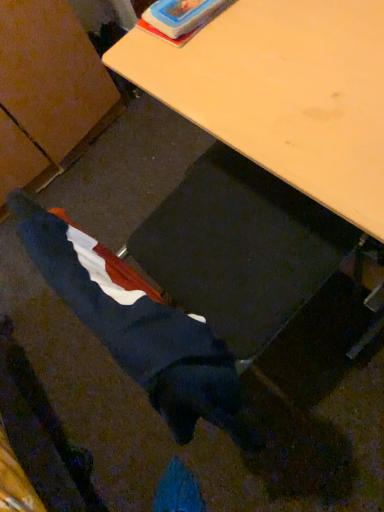
Question: Does velvet blue coat at lower left appear on the left side of wooden desk at center?

Choices:
 (A) no
 (B) yes

Answer: (B)

Question: Does velvet blue coat at lower left have a greater width compared to wooden desk at center?

Choices:
 (A) yes
 (B) no

Answer: (B)

Question: From the image's perspective, is velvet blue coat at lower left located beneath wooden desk at center?

Choices:
 (A) no
 (B) yes

Answer: (B)

Question: From the image's perspective, is velvet blue coat at lower left on top of wooden desk at center?

Choices:
 (A) no
 (B) yes

Answer: (A)

Question: Is velvet blue coat at lower left smaller than wooden desk at center?

Choices:
 (A) yes
 (B) no

Answer: (A)

Question: Is velvet blue coat at lower left far from wooden desk at center?

Choices:
 (A) no
 (B) yes

Answer: (A)

Question: Considering the relative positions of wooden desk at center and velvet blue coat at lower left in the image provided, is wooden desk at center to the left of velvet blue coat at lower left from the viewer's perspective?

Choices:
 (A) no
 (B) yes

Answer: (A)

Question: Considering the relative positions of wooden desk at center and velvet blue coat at lower left in the image provided, is wooden desk at center to the right of velvet blue coat at lower left from the viewer's perspective?

Choices:
 (A) yes
 (B) no

Answer: (A)

Question: Is velvet blue coat at lower left a part of wooden desk at center?

Choices:
 (A) yes
 (B) no

Answer: (B)

Question: Is wooden desk at center smaller than velvet blue coat at lower left?

Choices:
 (A) no
 (B) yes

Answer: (A)

Question: Are wooden desk at center and velvet blue coat at lower left far apart?

Choices:
 (A) no
 (B) yes

Answer: (A)

Question: From a real-world perspective, is wooden desk at center over velvet blue coat at lower left?

Choices:
 (A) yes
 (B) no

Answer: (B)

Question: In the image, is wooden desk at center positioned in front of or behind velvet blue coat at lower left?

Choices:
 (A) front
 (B) behind

Answer: (B)